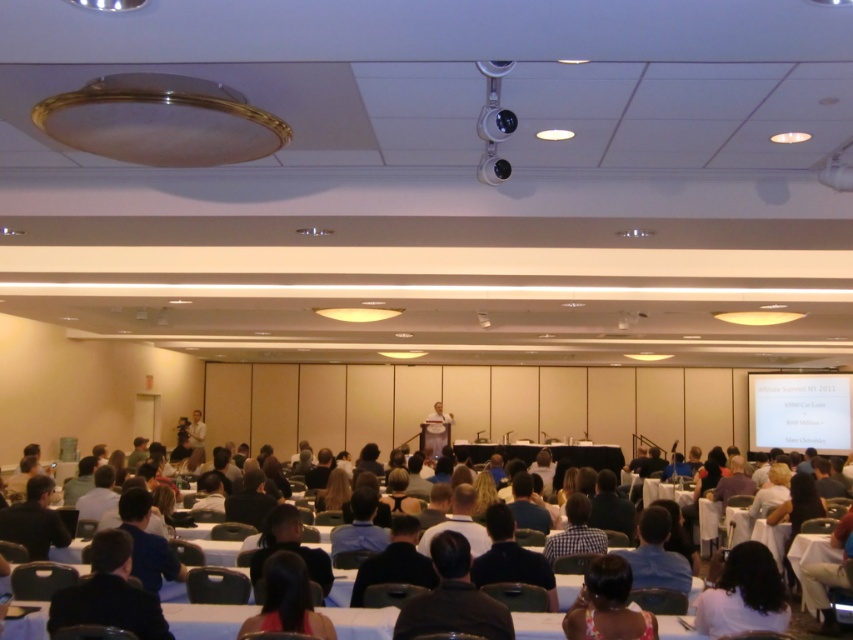
You are sitting in the dark brown chairs at center of the conference room and want to see the white matte projection screen at center. Can you see the screen clearly without any obstruction?

The dark brown chairs at center is shorter than white matte projection screen at center, so yes, you can see the screen clearly without any obstruction.

You are an event planner trying to set up a new projector in the conference room. The projector needs to be placed at point 0.969, 0.242. Are there any dark brown chairs at center in the way of this location?

The dark brown chairs at center are exactly at point (206, 620), so they are directly in the way of the projector placement location.